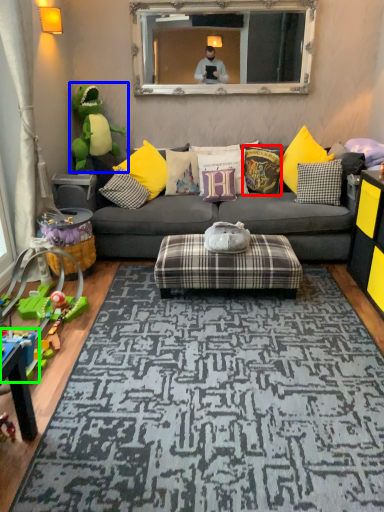
Question: Which is nearer to the pillow (highlighted by a red box)? toy (highlighted by a blue box) or toy (highlighted by a green box).

Choices:
 (A) toy
 (B) toy

Answer: (A)